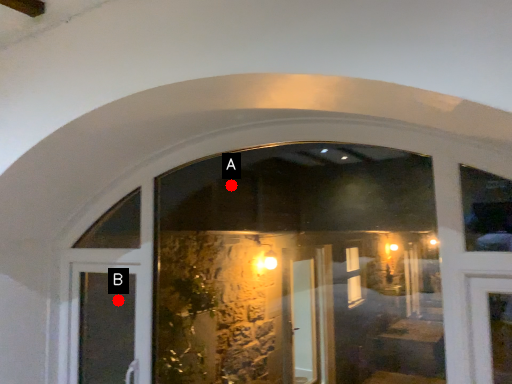
Question: Two points are circled on the image, labeled by A and B beside each circle. Which point is farther to the camera?

Choices:
 (A) A is further
 (B) B is further

Answer: (A)